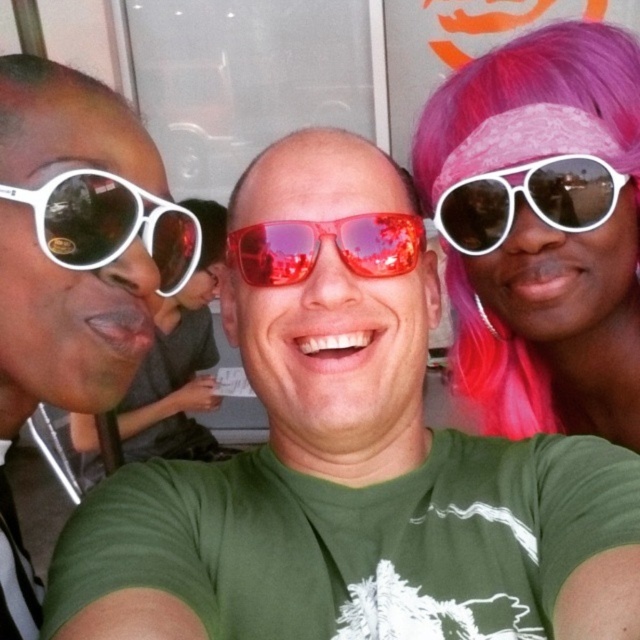
Is point (42, 122) closer to camera compared to point (468, 204)?

Yes, point (42, 122) is closer to viewer.

Can you confirm if matte white sunglasses at left is wider than white matte sunglasses at right?

Yes.

The width and height of the screenshot is (640, 640). I want to click on matte white sunglasses at left, so click(74, 268).

Describe the element at coordinates (541, 228) in the screenshot. The image size is (640, 640). I see `pink fabric bandana at upper right` at that location.

Which is above, pink fabric bandana at upper right or white matte sunglasses at left?

white matte sunglasses at left is above.

This screenshot has width=640, height=640. What do you see at coordinates (541, 228) in the screenshot?
I see `pink fabric bandana at upper right` at bounding box center [541, 228].

Identify the location of pink fabric bandana at upper right. This screenshot has height=640, width=640. (541, 228).

Does pink fabric bandana at upper right appear over white matte sunglasses at right?

Incorrect, pink fabric bandana at upper right is not positioned above white matte sunglasses at right.

Can you confirm if pink fabric bandana at upper right is taller than white matte sunglasses at right?

Yes, pink fabric bandana at upper right is taller than white matte sunglasses at right.

Which is in front, point (568, 147) or point (538, 204)?

Point (568, 147) is in front.

Locate an element on the screen. pink fabric bandana at upper right is located at coordinates (541, 228).